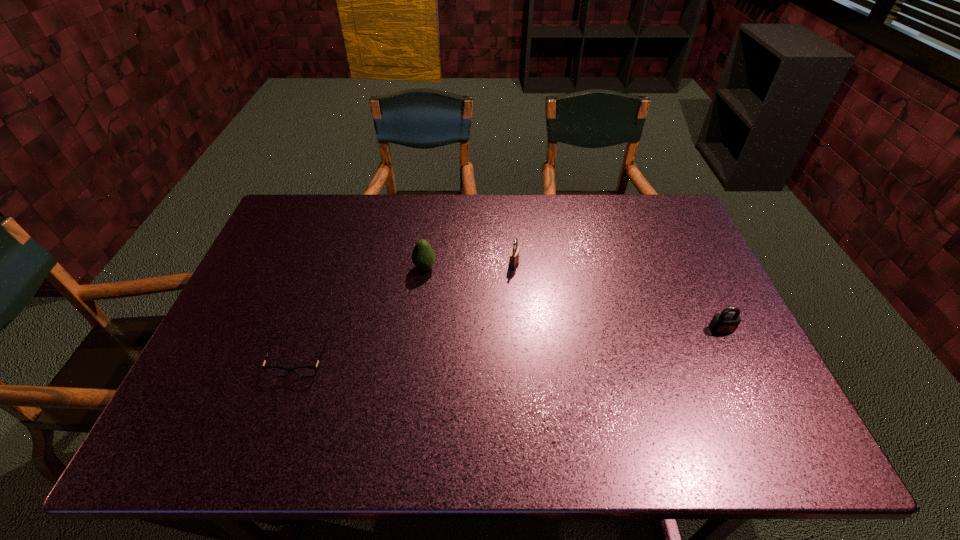
This screenshot has width=960, height=540. What are the coordinates of `vacant area that lies between the third object from left to right and the second nearest object` in the screenshot? It's located at (617, 296).

The height and width of the screenshot is (540, 960). Find the location of `vacant area between the nearest object and the second object from left to right`. vacant area between the nearest object and the second object from left to right is located at coordinates (362, 313).

The width and height of the screenshot is (960, 540). What are the coordinates of `vacant region between the nearest object and the farther padlock` in the screenshot? It's located at (407, 312).

Image resolution: width=960 pixels, height=540 pixels. Find the location of `vacant space that is in between the leftmost object and the farther padlock`. vacant space that is in between the leftmost object and the farther padlock is located at coordinates (407, 312).

I want to click on empty space between the third object from right to left and the second nearest object, so (x=573, y=299).

You are a GUI agent. You are given a task and a screenshot of the screen. Output one action in this format:
    pyautogui.click(x=<x>, y=<y>)
    Task: Click on the vacant region between the nearest object and the left padlock
    
    Given the screenshot: What is the action you would take?
    pyautogui.click(x=407, y=312)

I want to click on blank region between the nearest object and the farther padlock, so click(407, 312).

Where is `unoccupied area between the left padlock and the spectacles`? The height and width of the screenshot is (540, 960). unoccupied area between the left padlock and the spectacles is located at coordinates (407, 312).

Identify the location of object that is the third closest to the second object from left to right. This screenshot has width=960, height=540. (723, 323).

Locate an element on the screen. the second closest object to the nearer padlock is located at coordinates (423, 257).